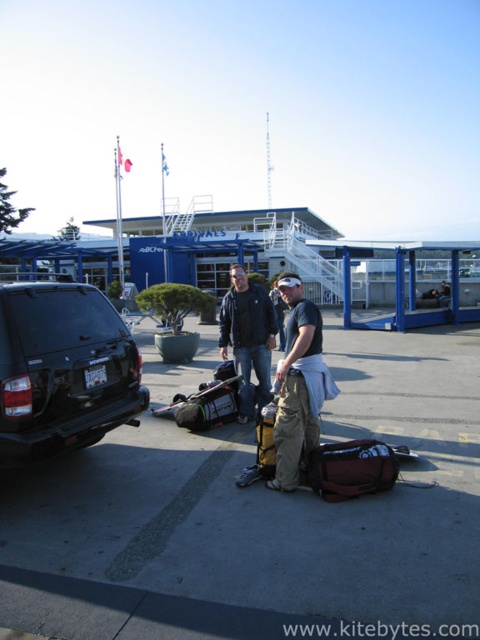
Question: Can you confirm if black rubber car at lower left is wider than matte black jacket at center?

Choices:
 (A) yes
 (B) no

Answer: (B)

Question: Is black rubber car at lower left positioned before black matte suv at left?

Choices:
 (A) no
 (B) yes

Answer: (A)

Question: Can you confirm if black rubber car at lower left is wider than matte black shirt at center?

Choices:
 (A) yes
 (B) no

Answer: (B)

Question: Which of the following is the farthest from the observer?

Choices:
 (A) black matte suv at left
 (B) matte black jacket at center
 (C) black rubber car at lower left
 (D) matte black shirt at center

Answer: (B)

Question: Among these objects, which one is nearest to the camera?

Choices:
 (A) matte black shirt at center
 (B) black matte suv at left
 (C) black rubber car at lower left
 (D) matte black jacket at center

Answer: (B)

Question: Which object appears closest to the camera in this image?

Choices:
 (A) matte black jacket at center
 (B) black matte suv at left

Answer: (B)